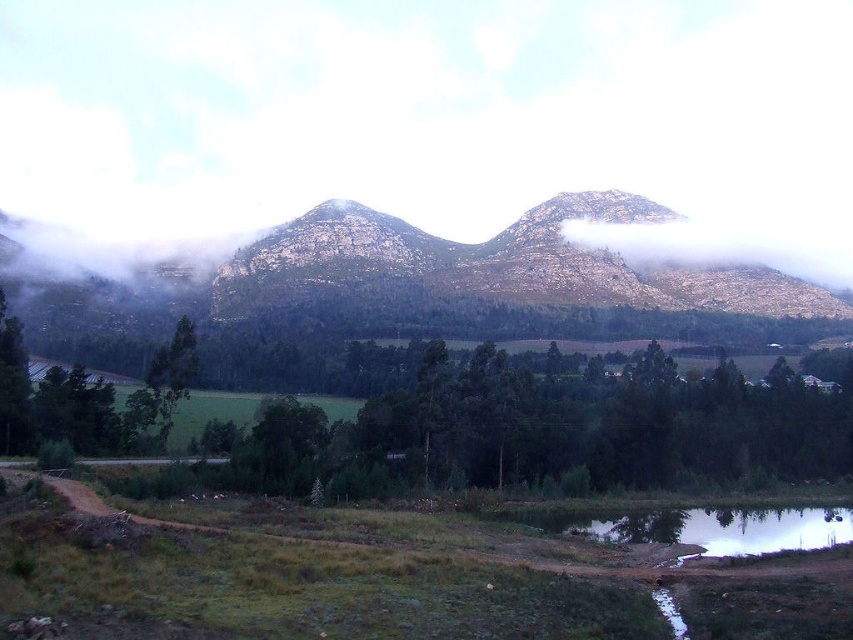
Between green leafy trees at center and smooth reflective water at bottom right, which one is positioned lower?

smooth reflective water at bottom right is below.

Does green leafy trees at center appear on the left side of smooth reflective water at bottom right?

Yes, green leafy trees at center is to the left of smooth reflective water at bottom right.

Measure the distance between point (763, 422) and camera.

A distance of 130.44 meters exists between point (763, 422) and camera.

The height and width of the screenshot is (640, 853). I want to click on green leafy trees at center, so click(x=555, y=426).

Is white foggy mountain at upper center in front of smooth reflective water at bottom right?

No, white foggy mountain at upper center is behind smooth reflective water at bottom right.

Who is shorter, white foggy mountain at upper center or smooth reflective water at bottom right?

Standing shorter between the two is smooth reflective water at bottom right.

Who is more distant from viewer, (679,252) or (842,516)?

Point (679,252)

Locate an element on the screen. The width and height of the screenshot is (853, 640). white foggy mountain at upper center is located at coordinates (430, 120).

You are a GUI agent. You are given a task and a screenshot of the screen. Output one action in this format:
    pyautogui.click(x=<x>, y=<y>)
    Task: Click on the green leafy trees at center
    Image resolution: width=853 pixels, height=640 pixels.
    Given the screenshot: What is the action you would take?
    pyautogui.click(x=555, y=426)

Does green leafy trees at center appear on the right side of rugged stone mountain at center?

Indeed, green leafy trees at center is positioned on the right side of rugged stone mountain at center.

At what (x,y) coordinates should I click in order to perform the action: click on green leafy trees at center. Please return your answer as a coordinate pair (x, y). This screenshot has width=853, height=640. Looking at the image, I should click on (555, 426).